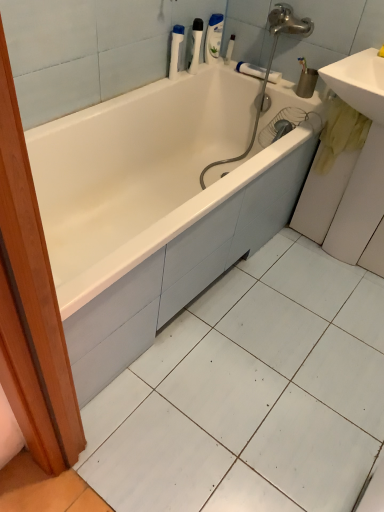
Question: From the image's perspective, is white glossy sink at right, which ranks as the 1th sink in bottom-to-top order, on white glossy sink at upper right, the second sink from the bottom?

Choices:
 (A) yes
 (B) no

Answer: (B)

Question: Does white glossy sink at right, which is counted as the second sink, starting from the top, have a greater height compared to white glossy sink at upper right, the second sink from the bottom?

Choices:
 (A) yes
 (B) no

Answer: (A)

Question: Is white glossy sink at right, which is counted as the second sink, starting from the top, positioned in front of white glossy sink at upper right, which is counted as the first sink, starting from the top?

Choices:
 (A) no
 (B) yes

Answer: (A)

Question: From a real-world perspective, is white glossy sink at right, which ranks as the 1th sink in bottom-to-top order, under white glossy sink at upper right, the second sink from the bottom?

Choices:
 (A) no
 (B) yes

Answer: (B)

Question: Does white glossy sink at right, which ranks as the 1th sink in bottom-to-top order, appear on the left side of white glossy sink at upper right, the second sink from the bottom?

Choices:
 (A) yes
 (B) no

Answer: (B)

Question: Is point (374, 74) closer or farther from the camera than point (244, 70)?

Choices:
 (A) farther
 (B) closer

Answer: (B)

Question: From the image's perspective, is white glossy sink at upper right, the second sink from the bottom, above or below white plastic towel bar at upper center?

Choices:
 (A) below
 (B) above

Answer: (A)

Question: Which is correct: white glossy sink at upper right, the second sink from the bottom, is inside white plastic towel bar at upper center, or outside of it?

Choices:
 (A) inside
 (B) outside

Answer: (B)

Question: Looking at their shapes, would you say white glossy sink at upper right, the second sink from the bottom, is wider or thinner than white plastic towel bar at upper center?

Choices:
 (A) thin
 (B) wide

Answer: (B)

Question: In terms of size, does white glossy bathtub at center appear bigger or smaller than white plastic bottle at upper center, which is the 1th cleaning product in left-to-right order?

Choices:
 (A) small
 (B) big

Answer: (B)

Question: From a real-world perspective, is white glossy bathtub at center above or below white plastic bottle at upper center, the second cleaning product from the back?

Choices:
 (A) below
 (B) above

Answer: (A)

Question: Would you say white glossy bathtub at center is to the left or to the right of white plastic bottle at upper center, the second cleaning product from the back, in the picture?

Choices:
 (A) right
 (B) left

Answer: (B)

Question: Is point (248, 192) positioned closer to the camera than point (172, 75)?

Choices:
 (A) closer
 (B) farther

Answer: (A)

Question: Based on their sizes in the image, would you say white glossy sink at right, which is counted as the second sink, starting from the top, is bigger or smaller than white plastic bottle at upper center, the first cleaning product from the front?

Choices:
 (A) small
 (B) big

Answer: (B)

Question: Is white glossy sink at right, which is counted as the second sink, starting from the top, spatially inside white plastic bottle at upper center, the first cleaning product from the front, or outside of it?

Choices:
 (A) outside
 (B) inside

Answer: (A)